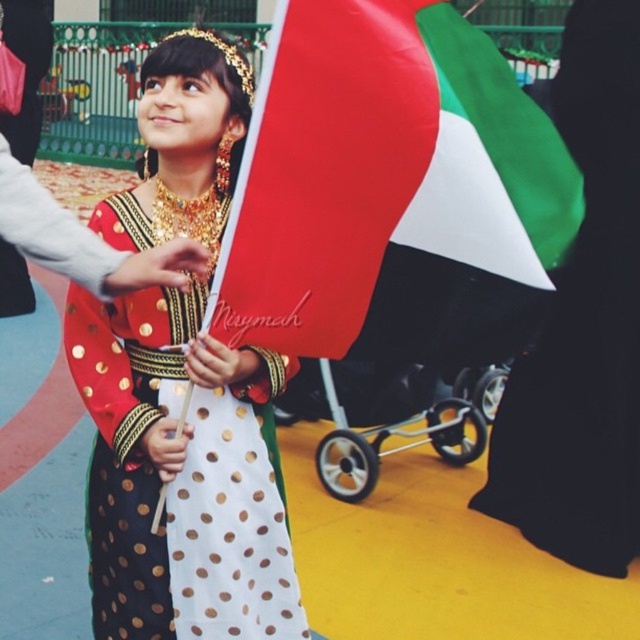
Who is taller, polyester flag at center or green fabric flag at right?

green fabric flag at right

Can you confirm if polyester flag at center is bigger than green fabric flag at right?

Actually, polyester flag at center might be smaller than green fabric flag at right.

Who is more distant from viewer, (404,192) or (630,285)?

Point (630,285)

You are a GUI agent. You are given a task and a screenshot of the screen. Output one action in this format:
    pyautogui.click(x=<x>, y=<y>)
    Task: Click on the polyester flag at center
    The height and width of the screenshot is (640, 640).
    Given the screenshot: What is the action you would take?
    pyautogui.click(x=392, y=192)

Is polyester flag at center taller than polka dot dress at center?

Incorrect, polyester flag at center's height is not larger of polka dot dress at center's.

Who is lower down, polyester flag at center or polka dot dress at center?

polka dot dress at center is lower down.

Which is in front, point (289, 3) or point (134, 417)?

Point (289, 3) is more forward.

Where is `polyester flag at center`? This screenshot has height=640, width=640. polyester flag at center is located at coordinates (392, 192).

Does polka dot dress at center lie behind green fabric flag at right?

No, it is not.

Identify the location of polka dot dress at center. (180, 474).